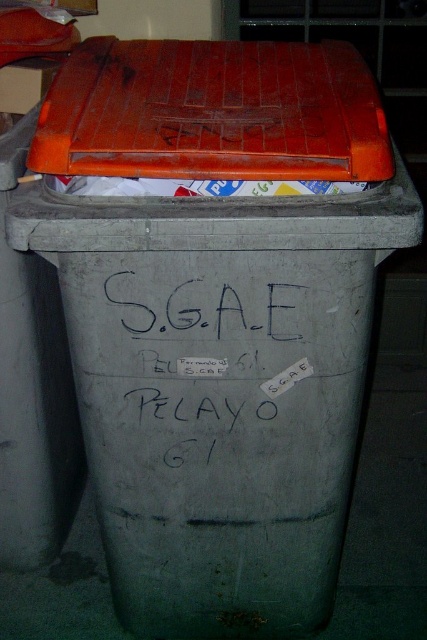
From the picture: Can you confirm if orange plastic lid at upper center is smaller than black matte writing at center?

No.

What do you see at coordinates (213, 113) in the screenshot?
I see `orange plastic lid at upper center` at bounding box center [213, 113].

Does point (363, 115) lie in front of point (128, 420)?

Yes.

Locate an element on the screen. orange plastic lid at upper center is located at coordinates (213, 113).